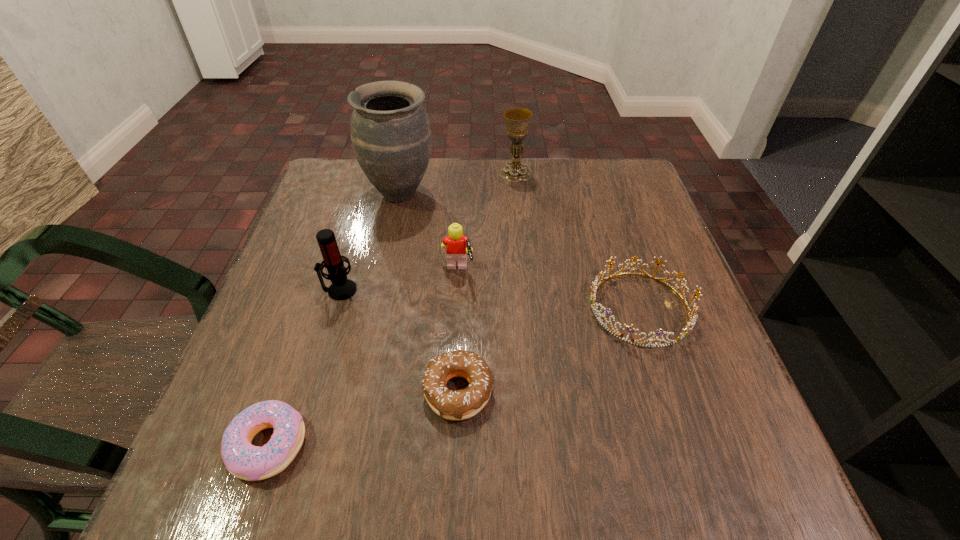
Image resolution: width=960 pixels, height=540 pixels. What are the coordinates of `vacant point located on the right of the microphone` in the screenshot? It's located at 401,290.

You are a GUI agent. You are given a task and a screenshot of the screen. Output one action in this format:
    pyautogui.click(x=<x>, y=<y>)
    Task: Click on the free space located in front of the fourth tallest object with the accessory visible
    Image resolution: width=960 pixels, height=540 pixels.
    Given the screenshot: What is the action you would take?
    pyautogui.click(x=565, y=272)

The image size is (960, 540). What are the coordinates of `blank space located on the front-facing side of the rightmost object` in the screenshot? It's located at (417, 307).

You are a GUI agent. You are given a task and a screenshot of the screen. Output one action in this format:
    pyautogui.click(x=<x>, y=<y>)
    Task: Click on the vacant space situated 0.050m on the front-facing side of the rightmost object
    
    Given the screenshot: What is the action you would take?
    pyautogui.click(x=562, y=307)

Identify the location of vacant space situated 0.250m on the front-facing side of the rightmost object. (458, 307).

In order to click on free region located on the right of the right doughnut in this screenshot , I will do `click(620, 392)`.

Locate an element on the screen. Image resolution: width=960 pixels, height=540 pixels. vacant space located 0.090m on the back of the left doughnut is located at coordinates (297, 361).

I want to click on urn that is at the far edge, so click(390, 131).

Find the location of a particular element. chalice present at the far edge is located at coordinates coord(517,120).

The height and width of the screenshot is (540, 960). I want to click on object present at the near edge, so click(242, 459).